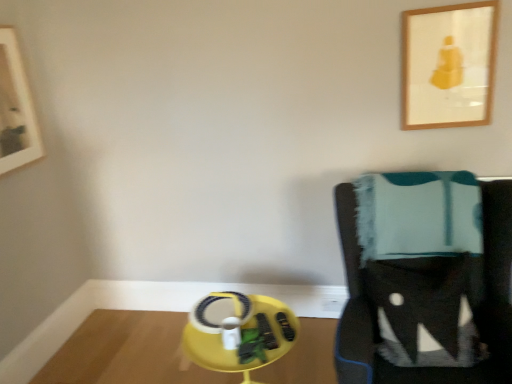
Where is `yellow plastic table at lower center`? This screenshot has width=512, height=384. yellow plastic table at lower center is located at coordinates (127, 352).

The width and height of the screenshot is (512, 384). What are the coordinates of `yellow plastic round table at lower center` in the screenshot? It's located at (239, 332).

Find the location of a particular element. Image resolution: width=512 pixels, height=384 pixels. knitted wool blanket at right is located at coordinates (426, 283).

At what (x,y) coordinates should I click in order to perform the action: click on wooden picture frame at upper left, positioned as the second picture frame in right-to-left order. Please return your answer as a coordinate pair (x, y). This screenshot has height=384, width=512. Looking at the image, I should click on (16, 108).

From a real-world perspective, does yellow plastic table at lower center stand above wooden picture frame at upper left, the 1th picture frame from the left?

No, from a real-world perspective, yellow plastic table at lower center is not on top of wooden picture frame at upper left, the 1th picture frame from the left.

Based on the photo, considering the positions of objects yellow plastic table at lower center and wooden picture frame at upper left, positioned as the second picture frame in right-to-left order, in the image provided, who is more to the left, yellow plastic table at lower center or wooden picture frame at upper left, positioned as the second picture frame in right-to-left order,?

wooden picture frame at upper left, positioned as the second picture frame in right-to-left order, is more to the left.

Is wooden picture frame at upper left, the 1th picture frame from the left, located within yellow plastic table at lower center?

Definitely not — wooden picture frame at upper left, the 1th picture frame from the left, is not inside yellow plastic table at lower center.

Is wooden picture frame at upper left, positioned as the second picture frame in right-to-left order, not inside yellow plastic round table at lower center?

Yes.

Considering their positions, is wooden picture frame at upper left, positioned as the second picture frame in right-to-left order, located in front of or behind yellow plastic round table at lower center?

Visually, wooden picture frame at upper left, positioned as the second picture frame in right-to-left order, is located behind yellow plastic round table at lower center.

Which is more to the right, wooden picture frame at upper left, positioned as the second picture frame in right-to-left order, or yellow plastic round table at lower center?

yellow plastic round table at lower center.

Is wooden picture frame at upper left, positioned as the second picture frame in right-to-left order, not close to yellow plastic round table at lower center?

Absolutely, wooden picture frame at upper left, positioned as the second picture frame in right-to-left order, is distant from yellow plastic round table at lower center.

From a real-world perspective, is wooden picture frame at upper left, the 1th picture frame from the left, above or below yellow plastic table at lower center?

In terms of real-world spatial position, wooden picture frame at upper left, the 1th picture frame from the left, is above yellow plastic table at lower center.

Is wooden picture frame at upper left, positioned as the second picture frame in right-to-left order, not close to yellow plastic table at lower center?

wooden picture frame at upper left, positioned as the second picture frame in right-to-left order, is positioned a significant distance from yellow plastic table at lower center.

Considering the relative positions of wooden picture frame at upper left, the 1th picture frame from the left, and yellow plastic table at lower center in the image provided, is wooden picture frame at upper left, the 1th picture frame from the left, to the left of yellow plastic table at lower center from the viewer's perspective?

Correct, you'll find wooden picture frame at upper left, the 1th picture frame from the left, to the left of yellow plastic table at lower center.

Is the depth of wooden picture frame at upper left, positioned as the second picture frame in right-to-left order, less than that of yellow plastic table at lower center?

Yes, the depth of wooden picture frame at upper left, positioned as the second picture frame in right-to-left order, is less than that of yellow plastic table at lower center.

Is yellow plastic round table at lower center surrounding wooden picture frame at upper left, positioned as the second picture frame in right-to-left order?

No, wooden picture frame at upper left, positioned as the second picture frame in right-to-left order, is not inside yellow plastic round table at lower center.

From the image's perspective, count 1st picture frames upward from the yellow plastic round table at lower center and point to it. Please provide its 2D coordinates.

[(16, 108)]

Can you confirm if yellow plastic round table at lower center is positioned to the left of wooden picture frame at upper left, the 1th picture frame from the left?

In fact, yellow plastic round table at lower center is to the right of wooden picture frame at upper left, the 1th picture frame from the left.

Which object is wider, yellow plastic round table at lower center or wooden picture frame at upper left, positioned as the second picture frame in right-to-left order?

yellow plastic round table at lower center.

Is wooden picture frame at upper left, positioned as the second picture frame in right-to-left order, wider than knitted wool blanket at right?

No, wooden picture frame at upper left, positioned as the second picture frame in right-to-left order, is not wider than knitted wool blanket at right.

Can you tell me how much wooden picture frame at upper left, positioned as the second picture frame in right-to-left order, and knitted wool blanket at right differ in facing direction?

wooden picture frame at upper left, positioned as the second picture frame in right-to-left order, and knitted wool blanket at right are facing 90.9 degrees away from each other.

Between wooden picture frame at upper left, positioned as the second picture frame in right-to-left order, and knitted wool blanket at right, which one has smaller size?

wooden picture frame at upper left, positioned as the second picture frame in right-to-left order, is smaller.

From the image's perspective, is wooden picture frame at upper left, positioned as the second picture frame in right-to-left order, over knitted wool blanket at right?

Yes.

Could you tell me if wooden picture frame at upper left, the 1th picture frame from the left, is facing wooden picture frame at upper right, the second picture frame when ordered from left to right?

Yes, wooden picture frame at upper left, the 1th picture frame from the left, is turned towards wooden picture frame at upper right, the second picture frame when ordered from left to right.

Is point (17, 82) positioned before point (449, 34)?

No, it is behind (449, 34).

Considering the relative sizes of wooden picture frame at upper left, the 1th picture frame from the left, and wooden picture frame at upper right, marked as the first picture frame in a right-to-left arrangement, in the image provided, is wooden picture frame at upper left, the 1th picture frame from the left, bigger than wooden picture frame at upper right, marked as the first picture frame in a right-to-left arrangement,?

Indeed, wooden picture frame at upper left, the 1th picture frame from the left, has a larger size compared to wooden picture frame at upper right, marked as the first picture frame in a right-to-left arrangement.

Consider the image. From a real-world perspective, is wooden picture frame at upper left, positioned as the second picture frame in right-to-left order, physically located above or below wooden picture frame at upper right, marked as the first picture frame in a right-to-left arrangement?

From a real-world perspective, wooden picture frame at upper left, positioned as the second picture frame in right-to-left order, is physically above wooden picture frame at upper right, marked as the first picture frame in a right-to-left arrangement.

Can you tell me how much yellow plastic table at lower center and knitted wool blanket at right differ in facing direction?

The angle between the facing direction of yellow plastic table at lower center and the facing direction of knitted wool blanket at right is 90.5 degrees.

Is yellow plastic table at lower center placed right next to knitted wool blanket at right?

No, yellow plastic table at lower center is not beside knitted wool blanket at right.

Is yellow plastic table at lower center spatially inside knitted wool blanket at right, or outside of it?

yellow plastic table at lower center exists outside the volume of knitted wool blanket at right.

I want to click on furniture that appears in front of the yellow plastic table at lower center, so (x=426, y=283).

Identify the location of table on the right of wooden picture frame at upper left, the 1th picture frame from the left. (127, 352).

I want to click on the 2nd picture frame behind the yellow plastic round table at lower center, starting your count from the anchor, so click(x=16, y=108).

Considering their positions, is yellow plastic round table at lower center positioned closer to wooden picture frame at upper right, marked as the first picture frame in a right-to-left arrangement, than knitted wool blanket at right?

Among the two, knitted wool blanket at right is located nearer to wooden picture frame at upper right, marked as the first picture frame in a right-to-left arrangement.

From the picture: When comparing their distances from yellow plastic round table at lower center, does yellow plastic table at lower center or knitted wool blanket at right seem further?

yellow plastic table at lower center is positioned further to the anchor yellow plastic round table at lower center.

Which object lies nearer to the anchor point wooden picture frame at upper left, positioned as the second picture frame in right-to-left order, yellow plastic table at lower center or yellow plastic round table at lower center?

The object closer to wooden picture frame at upper left, positioned as the second picture frame in right-to-left order, is yellow plastic table at lower center.

From the image, which object appears to be farther from yellow plastic table at lower center, yellow plastic round table at lower center or knitted wool blanket at right?

knitted wool blanket at right is positioned further to the anchor yellow plastic table at lower center.

Estimate the real-world distances between objects in this image. Which object is closer to yellow plastic round table at lower center, wooden picture frame at upper right, marked as the first picture frame in a right-to-left arrangement, or knitted wool blanket at right?

knitted wool blanket at right is positioned closer to the anchor yellow plastic round table at lower center.

Considering their positions, is knitted wool blanket at right positioned further to wooden picture frame at upper left, positioned as the second picture frame in right-to-left order, than yellow plastic round table at lower center?

knitted wool blanket at right is further to wooden picture frame at upper left, positioned as the second picture frame in right-to-left order.

When comparing their distances from knitted wool blanket at right, does wooden picture frame at upper right, the second picture frame when ordered from left to right, or yellow plastic table at lower center seem further?

Based on the image, yellow plastic table at lower center appears to be further to knitted wool blanket at right.

Estimate the real-world distances between objects in this image. Which object is closer to knitted wool blanket at right, wooden picture frame at upper left, the 1th picture frame from the left, or yellow plastic round table at lower center?

The object closer to knitted wool blanket at right is yellow plastic round table at lower center.

Locate an element on the screen. Image resolution: width=512 pixels, height=384 pixels. round table between yellow plastic table at lower center and knitted wool blanket at right from left to right is located at coordinates (239, 332).

Where is `furniture between wooden picture frame at upper right, marked as the first picture frame in a right-to-left arrangement, and yellow plastic table at lower center from top to bottom`? This screenshot has width=512, height=384. furniture between wooden picture frame at upper right, marked as the first picture frame in a right-to-left arrangement, and yellow plastic table at lower center from top to bottom is located at coordinates click(x=426, y=283).

Identify the location of round table between wooden picture frame at upper left, positioned as the second picture frame in right-to-left order, and wooden picture frame at upper right, the second picture frame when ordered from left to right, in the horizontal direction. (239, 332).

Identify the location of round table that lies between wooden picture frame at upper left, the 1th picture frame from the left, and yellow plastic table at lower center from top to bottom. (239, 332).